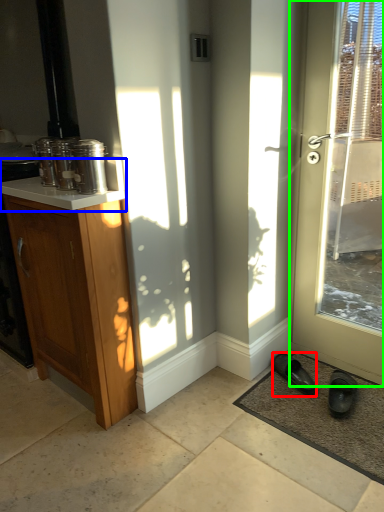
Question: Considering the real-world distances, which object is farthest from footwear (highlighted by a red box)? counter top (highlighted by a blue box) or door (highlighted by a green box)?

Choices:
 (A) counter top
 (B) door

Answer: (A)